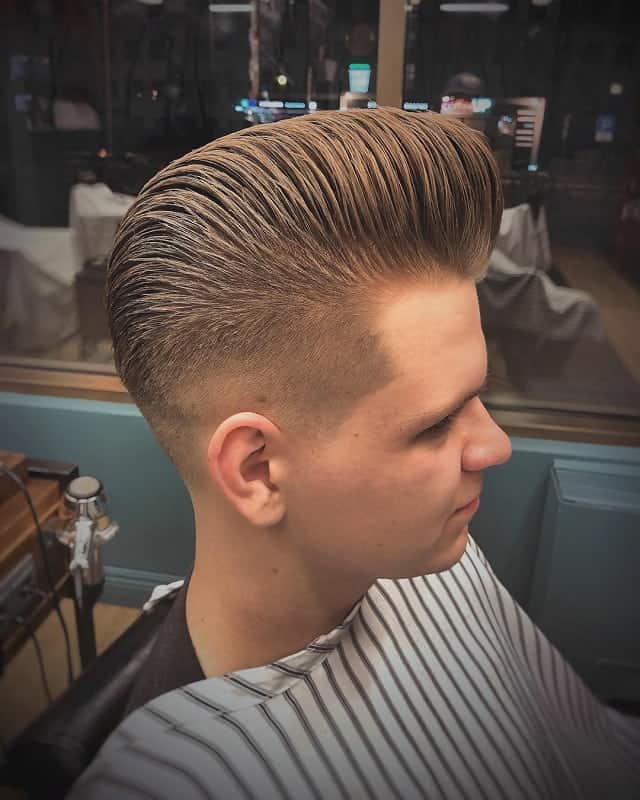
The height and width of the screenshot is (800, 640). Identify the location of salon cape. (344, 738).